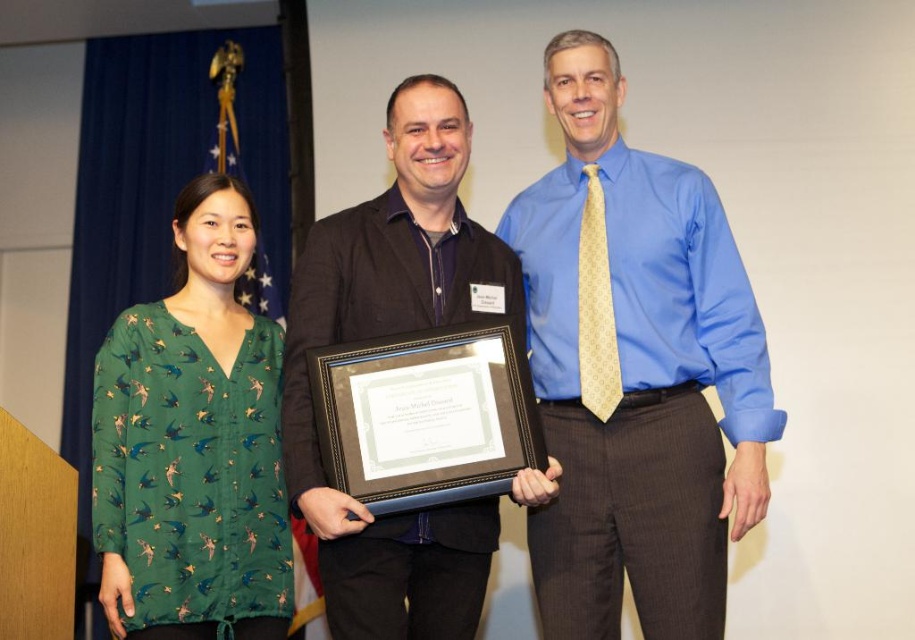
In the scene shown: You are attending a formal event and notice two attendees wearing the green printed blouse at left and the black matte suit at center. Which of these two outfits is shorter in length?

The green printed blouse at left is shorter than the black matte suit at center.

You are organizing a charity event and need to display two donated items from the image. The blue silk shirt at center and the green printed blouse at left must be placed on a rack. Which one requires a larger hanger?

The blue silk shirt at center requires a larger hanger because it is bigger than the green printed blouse at left.

You are standing at the camera position and want to take a photo of the scene. If you move forward by 1 meter, will the point at coordinates point (231, 580) be closer to the camera?

The point at coordinates point (231, 580) is 2.17 meters from the camera. If you move forward by 1 meter, the distance becomes 1.17 meters, so yes, it will be closer.